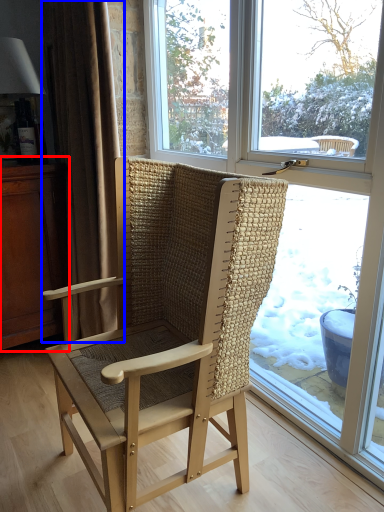
Question: Which object is closer to the camera taking this photo, dresser (highlighted by a red box) or curtain (highlighted by a blue box)?

Choices:
 (A) dresser
 (B) curtain

Answer: (B)